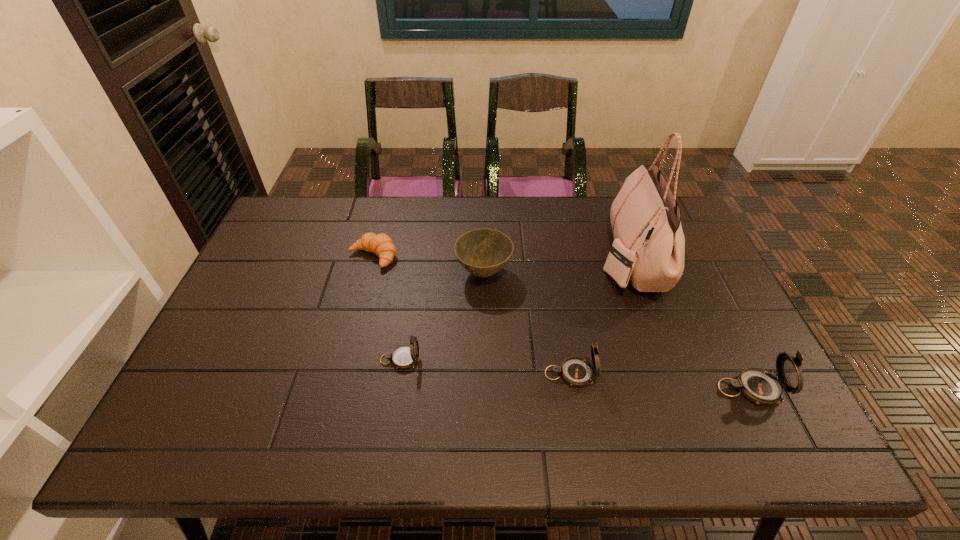
The image size is (960, 540). Find the location of `the shortest object`. the shortest object is located at coordinates (381, 244).

Find the location of a particular element. This screenshot has height=540, width=960. blank space located 0.180m on the face of the leftmost compass is located at coordinates (492, 360).

Locate an element on the screen. vacant space located 0.100m on the face of the third object from right to left is located at coordinates (637, 374).

This screenshot has height=540, width=960. Identify the location of blank area located on the right of the bowl. (636, 272).

You are a GUI agent. You are given a task and a screenshot of the screen. Output one action in this format:
    pyautogui.click(x=<x>, y=<y>)
    Task: Click on the free space located 0.070m on the side of the second object from right to left with the attached pouch
    
    Given the screenshot: What is the action you would take?
    pyautogui.click(x=577, y=258)

I want to click on blank space located 0.250m on the side of the second object from right to left with the attached pouch, so click(x=518, y=258).

Find the location of a particular element. The image size is (960, 540). vacant space located on the side of the second object from right to left with the attached pouch is located at coordinates (492, 258).

This screenshot has height=540, width=960. In order to click on free region located 0.140m on the left of the crescent roll in this screenshot , I will do `click(303, 256)`.

Locate an element on the screen. object located in the far edge section of the desktop is located at coordinates (649, 245).

Find the location of a particular element. The image size is (960, 540). compass located at the right edge is located at coordinates (758, 385).